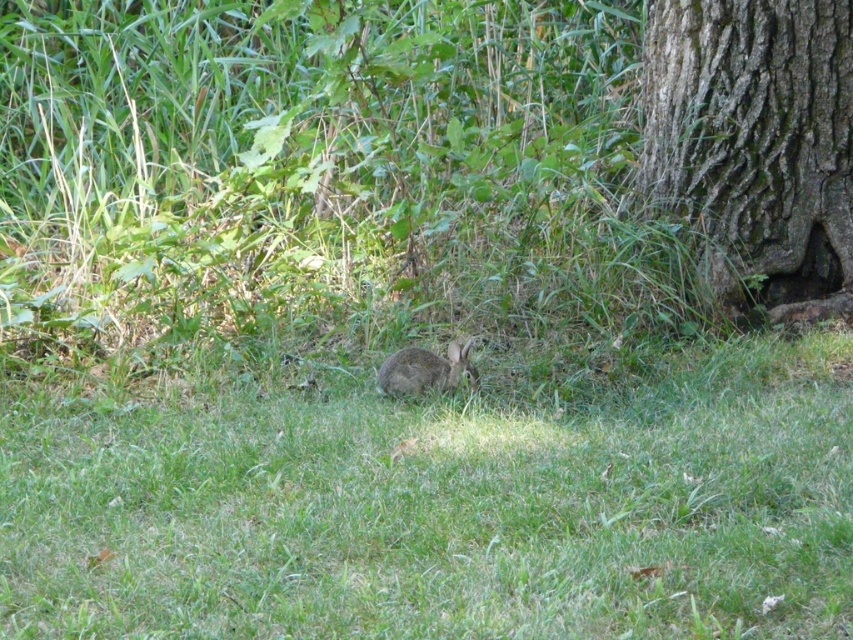
You are a photographer setting up a shot of the gray textured bark at lower right and the fuzzy brown rabbit at center. Which object will require a wider lens to capture its full size in the frame?

The gray textured bark at lower right is larger in size than the fuzzy brown rabbit at center, so it will require a wider lens to capture its full size in the frame.

Looking at this image, you are standing in the grassy area and want to walk from point (786,179) to point (387,364). Which direction should you move to get closer to your destination?

To move from point (786,179) to point (387,364), you should move towards the lower right direction since point (387,364) is closer to the viewer compared to point (786,179).

You are an observer looking at the scene. You see the gray textured bark at lower right and the fuzzy brown rabbit at center. Which object is located to the right of the other?

The gray textured bark at lower right is positioned on the right side of the fuzzy brown rabbit at center.